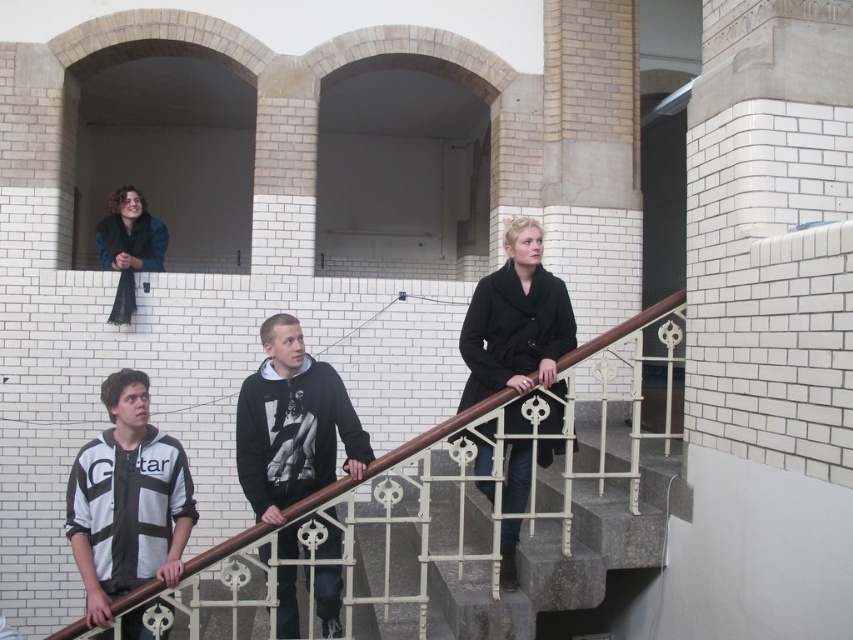
Does black matte coat at center have a larger size compared to dark blue jacket at upper left?

Correct, black matte coat at center is larger in size than dark blue jacket at upper left.

Between point (479, 362) and point (100, 248), which one is positioned in front?

Positioned in front is point (479, 362).

Where is `black matte coat at center`? black matte coat at center is located at coordinates (515, 321).

Can you confirm if brown polished wood at lower center is smaller than dark blue jacket at upper left?

No, brown polished wood at lower center is not smaller than dark blue jacket at upper left.

Is point (271, 525) positioned after point (132, 204)?

No.

Where is `brown polished wood at lower center`? This screenshot has width=853, height=640. brown polished wood at lower center is located at coordinates [x=438, y=432].

What do you see at coordinates (126, 499) in the screenshot?
I see `white printed shirt at lower left` at bounding box center [126, 499].

Locate an element on the screen. white printed shirt at lower left is located at coordinates (126, 499).